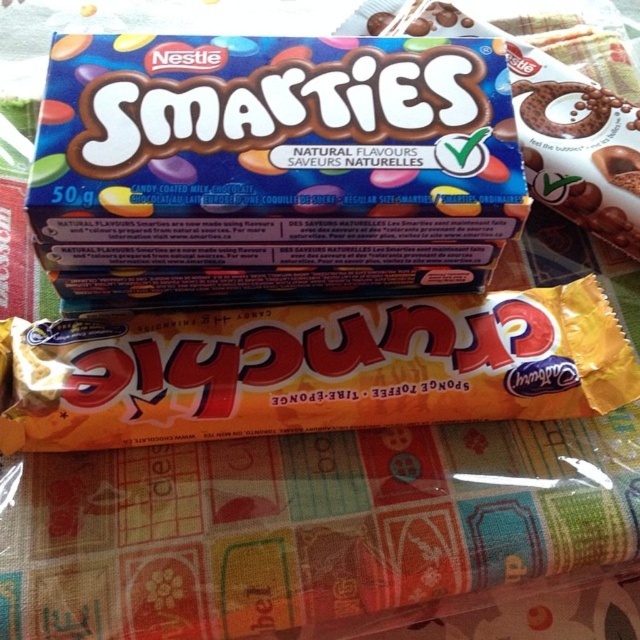
Can you confirm if yellow sponge toffee at center is smaller than smooth chocolate bar at center?

No, yellow sponge toffee at center is not smaller than smooth chocolate bar at center.

Which is below, yellow sponge toffee at center or smooth chocolate bar at center?

yellow sponge toffee at center is below.

You are a GUI agent. You are given a task and a screenshot of the screen. Output one action in this format:
    pyautogui.click(x=<x>, y=<y>)
    Task: Click on the yellow sponge toffee at center
    This screenshot has height=640, width=640.
    Given the screenshot: What is the action you would take?
    pos(312,369)

Can you confirm if matte chocolate smarties at upper center is thinner than smooth chocolate bar at center?

In fact, matte chocolate smarties at upper center might be wider than smooth chocolate bar at center.

Is matte chocolate smarties at upper center positioned at the back of smooth chocolate bar at center?

No, matte chocolate smarties at upper center is in front of smooth chocolate bar at center.

I want to click on matte chocolate smarties at upper center, so click(x=273, y=164).

Does matte chocolate smarties at upper center have a lesser width compared to yellow sponge toffee at center?

Indeed, matte chocolate smarties at upper center has a lesser width compared to yellow sponge toffee at center.

Describe the element at coordinates (273, 164) in the screenshot. Image resolution: width=640 pixels, height=640 pixels. I see `matte chocolate smarties at upper center` at that location.

Locate an element on the screen. matte chocolate smarties at upper center is located at coordinates (273, 164).